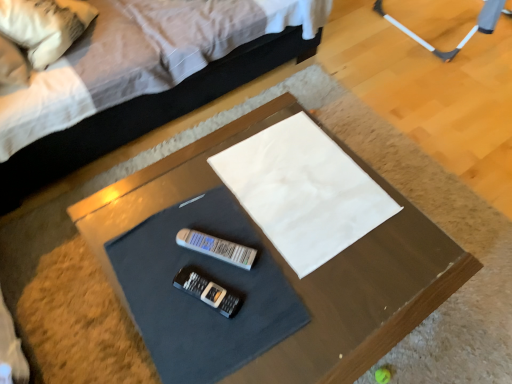
Locate an element on the screen. free spot to the left of white fabric at center is located at coordinates (177, 208).